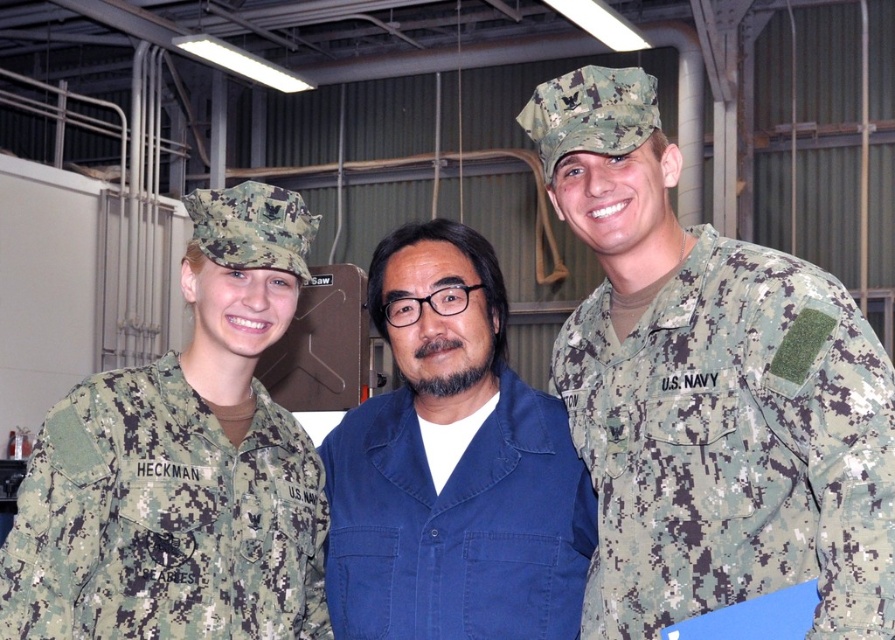
What do you see at coordinates (164, 518) in the screenshot? I see `digital camouflage uniform at left` at bounding box center [164, 518].

The width and height of the screenshot is (895, 640). Identify the location of digital camouflage uniform at left. (164, 518).

Measure the distance between point (x=146, y=438) and camera.

Point (x=146, y=438) is 6.28 feet away from camera.

Where is `digital camouflage uniform at left`? Image resolution: width=895 pixels, height=640 pixels. digital camouflage uniform at left is located at coordinates (164, 518).

Between digital camouflage uniform at right and digital camouflage uniform at left, which one is positioned higher?

digital camouflage uniform at right is higher up.

This screenshot has width=895, height=640. Find the location of `digital camouflage uniform at right`. digital camouflage uniform at right is located at coordinates (732, 444).

Does digital camouflage uniform at right come in front of blue cotton shirt at center?

Yes, it is.

What do you see at coordinates (732, 444) in the screenshot?
I see `digital camouflage uniform at right` at bounding box center [732, 444].

Who is more forward, (830, 385) or (330, 557)?

Point (830, 385)

Locate an element on the screen. The width and height of the screenshot is (895, 640). digital camouflage uniform at right is located at coordinates (732, 444).